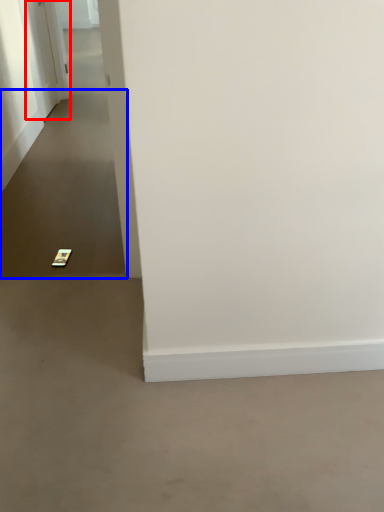
Question: Among these objects, which one is farthest to the camera, door (highlighted by a red box) or path (highlighted by a blue box)?

Choices:
 (A) door
 (B) path

Answer: (A)